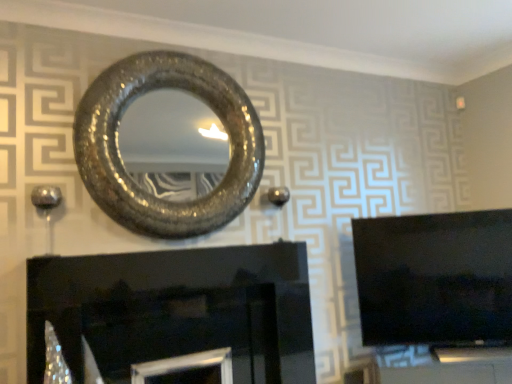
Question: Is black glossy fireplace at lower center shorter than shiny metallic mirror at upper center?

Choices:
 (A) yes
 (B) no

Answer: (A)

Question: From a real-world perspective, is black glossy fireplace at lower center beneath shiny metallic mirror at upper center?

Choices:
 (A) yes
 (B) no

Answer: (A)

Question: Is the depth of black glossy fireplace at lower center less than that of shiny metallic mirror at upper center?

Choices:
 (A) no
 (B) yes

Answer: (B)

Question: Is black glossy fireplace at lower center looking in the opposite direction of shiny metallic mirror at upper center?

Choices:
 (A) yes
 (B) no

Answer: (B)

Question: Is black glossy fireplace at lower center behind shiny metallic mirror at upper center?

Choices:
 (A) no
 (B) yes

Answer: (A)

Question: From the image's perspective, is black glossy fireplace at lower center on shiny metallic mirror at upper center?

Choices:
 (A) no
 (B) yes

Answer: (A)

Question: Is black glossy tv at right closer to camera compared to black glossy fireplace at lower center?

Choices:
 (A) no
 (B) yes

Answer: (A)

Question: From the image's perspective, would you say black glossy tv at right is positioned over black glossy fireplace at lower center?

Choices:
 (A) no
 (B) yes

Answer: (B)

Question: From a real-world perspective, does black glossy tv at right sit lower than black glossy fireplace at lower center?

Choices:
 (A) yes
 (B) no

Answer: (B)

Question: Could you tell me if black glossy tv at right is facing black glossy fireplace at lower center?

Choices:
 (A) no
 (B) yes

Answer: (A)

Question: Is black glossy tv at right at the left side of black glossy fireplace at lower center?

Choices:
 (A) yes
 (B) no

Answer: (B)

Question: Does black glossy tv at right have a lesser width compared to black glossy fireplace at lower center?

Choices:
 (A) no
 (B) yes

Answer: (B)

Question: From the image's perspective, does black glossy fireplace at lower center appear lower than black glossy tv at right?

Choices:
 (A) yes
 (B) no

Answer: (A)